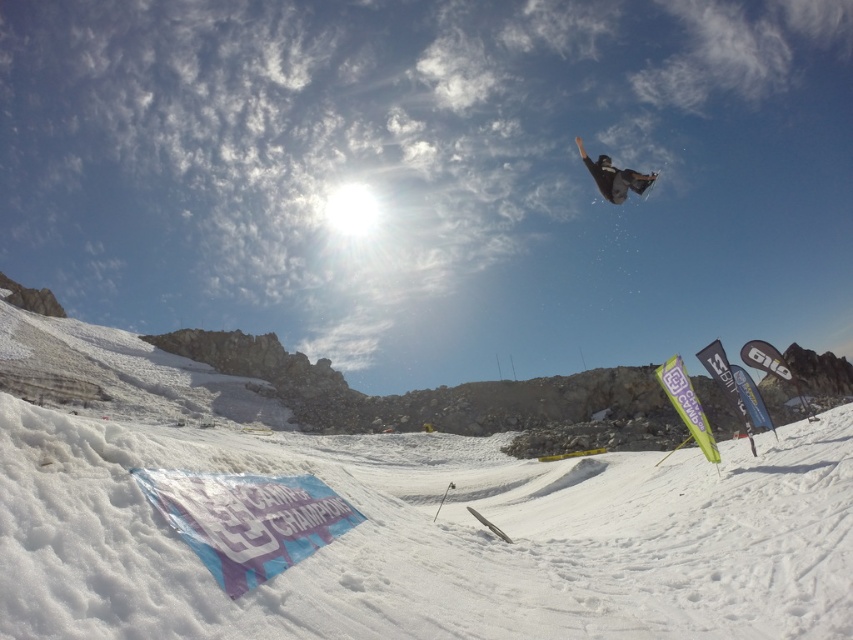
Is point (259, 467) more distant than point (602, 193)?

No, it is not.

You are a GUI agent. You are given a task and a screenshot of the screen. Output one action in this format:
    pyautogui.click(x=<x>, y=<y>)
    Task: Click on the white fluffy snow at lower center
    The width and height of the screenshot is (853, 640).
    Given the screenshot: What is the action you would take?
    pyautogui.click(x=433, y=540)

Is point (460, 531) closer to viewer compared to point (648, 182)?

Yes, point (460, 531) is closer to viewer.

Is white fluffy snow at lower center further to the viewer compared to black matte snowboard at upper center?

No, it is not.

Where is `white fluffy snow at lower center`? Image resolution: width=853 pixels, height=640 pixels. white fluffy snow at lower center is located at coordinates (433, 540).

Is matte black snowboarder at upper right taller than black matte snowboard at upper center?

Correct, matte black snowboarder at upper right is much taller as black matte snowboard at upper center.

How far apart are matte black snowboarder at upper right and black matte snowboard at upper center?

matte black snowboarder at upper right is 63.55 meters from black matte snowboard at upper center.

The image size is (853, 640). Identify the location of matte black snowboarder at upper right. (614, 177).